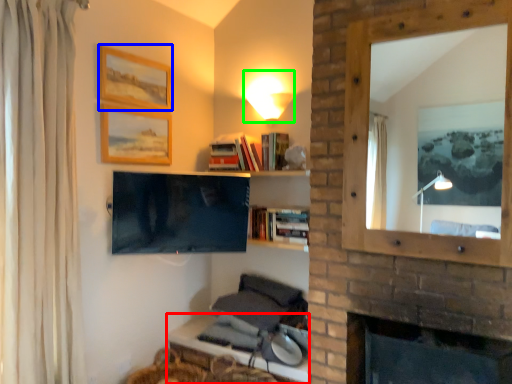
Question: Which object is the closest to the table (highlighted by a red box)? Choose among these: picture frame (highlighted by a blue box) or light fixture (highlighted by a green box).

Choices:
 (A) picture frame
 (B) light fixture

Answer: (B)